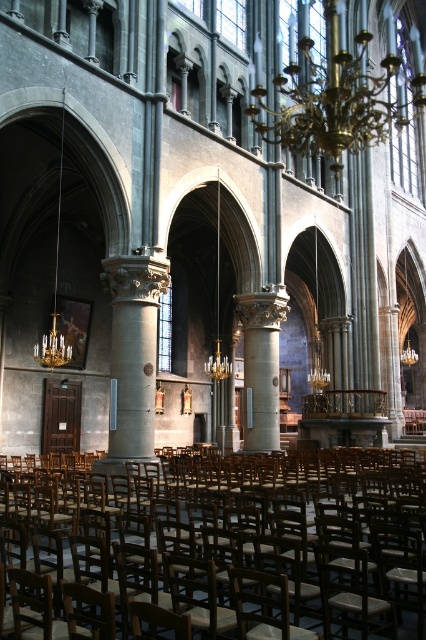
Does wooden chair at center come in front of gold metallic chandelier at upper center?

Yes, it is.

You are a GUI agent. You are given a task and a screenshot of the screen. Output one action in this format:
    pyautogui.click(x=<x>, y=<y>)
    Task: Click on the wooden chair at center
    Image resolution: width=426 pixels, height=640 pixels.
    Given the screenshot: What is the action you would take?
    pyautogui.click(x=195, y=547)